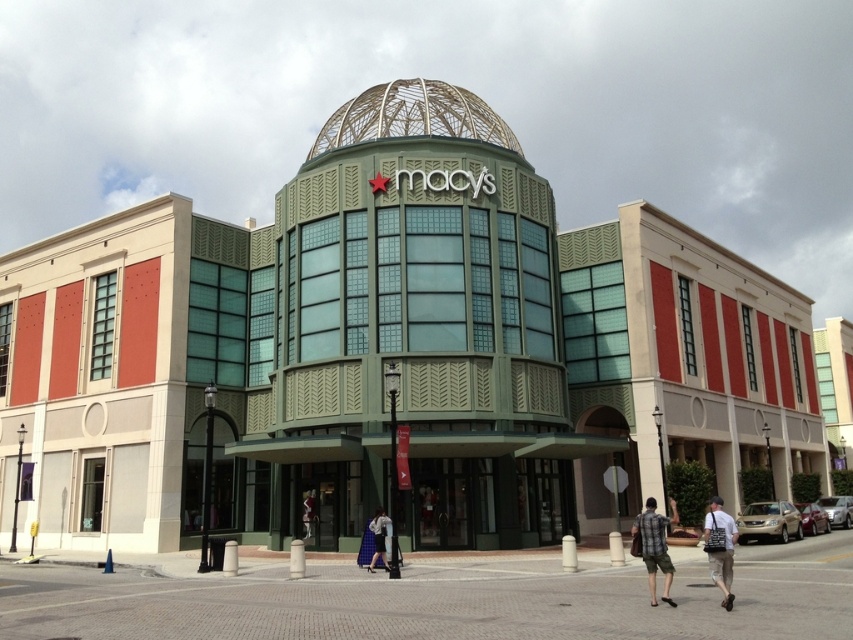
Question: Is plaid fabric shirt at lower right wider than denim pants at lower center?

Choices:
 (A) yes
 (B) no

Answer: (A)

Question: Based on their relative distances, which object is nearer to the denim pants at lower center?

Choices:
 (A) plaid fabric shirt at lower right
 (B) metallic wireframe dome at center
 (C) khaki cotton shorts at lower right
 (D) green glass dome at center

Answer: (A)

Question: Does green glass dome at center have a lesser width compared to plaid fabric shirt at lower right?

Choices:
 (A) no
 (B) yes

Answer: (A)

Question: Among these objects, which one is farthest from the camera?

Choices:
 (A) denim pants at lower center
 (B) khaki cotton shorts at lower right

Answer: (A)

Question: Considering the real-world distances, which object is farthest from the metallic wireframe dome at center?

Choices:
 (A) denim pants at lower center
 (B) khaki cotton shorts at lower right

Answer: (B)

Question: Does metallic wireframe dome at center appear under khaki cotton shorts at lower right?

Choices:
 (A) yes
 (B) no

Answer: (B)